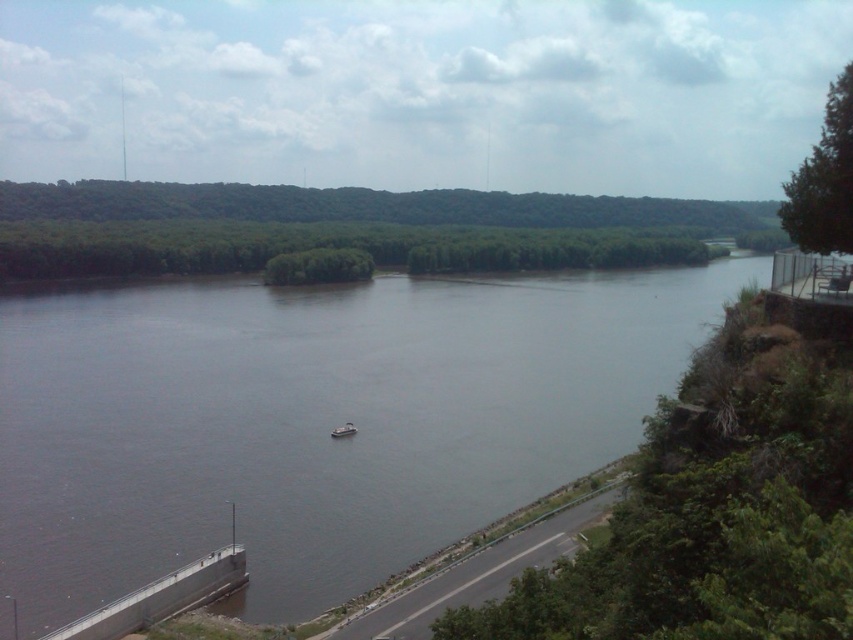
You are standing at the riverside and want to determine the relative positions of two points marked on the image. Which point is closer to you, point at coordinates [212,401] or point at coordinates [351,429]?

Point at coordinates [212,401] is closer to you because it is further to the viewer than point at coordinates [351,429].

You are standing on the riverside road and see the brown water at center and the white plastic boat at center. Which object is positioned to the right when looking towards the river?

The brown water at center is to the right of the white plastic boat at center, so the brown water at center is positioned to the right.

You are standing on the riverside path and want to take a photo of the brown water at center. If your camera can focus on objects up to 100 feet away, will you need to move closer to capture a clear image?

The brown water at center is 110.92 feet away from the camera. Since the camera can focus up to 100 feet, you need to move closer to ensure the brown water at center is within the focus range.